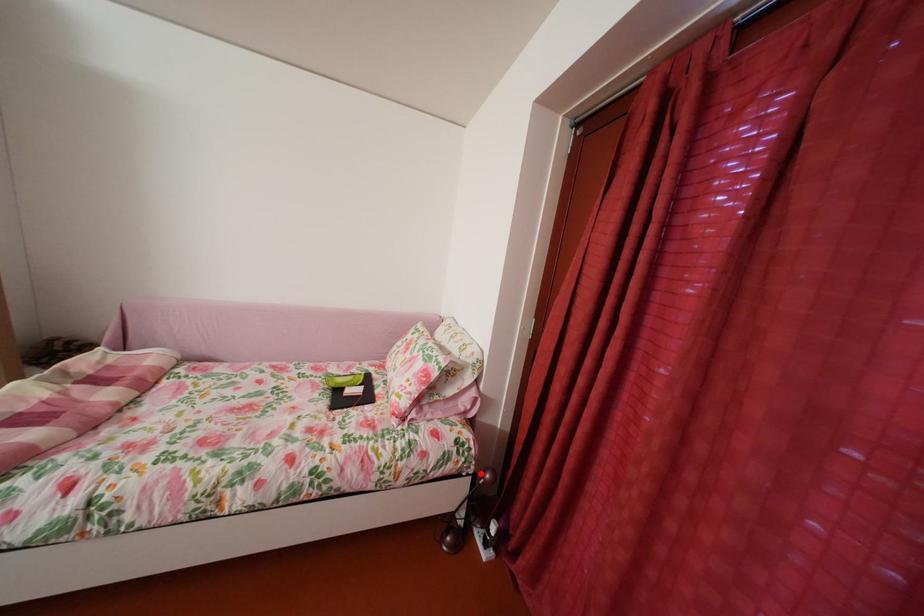
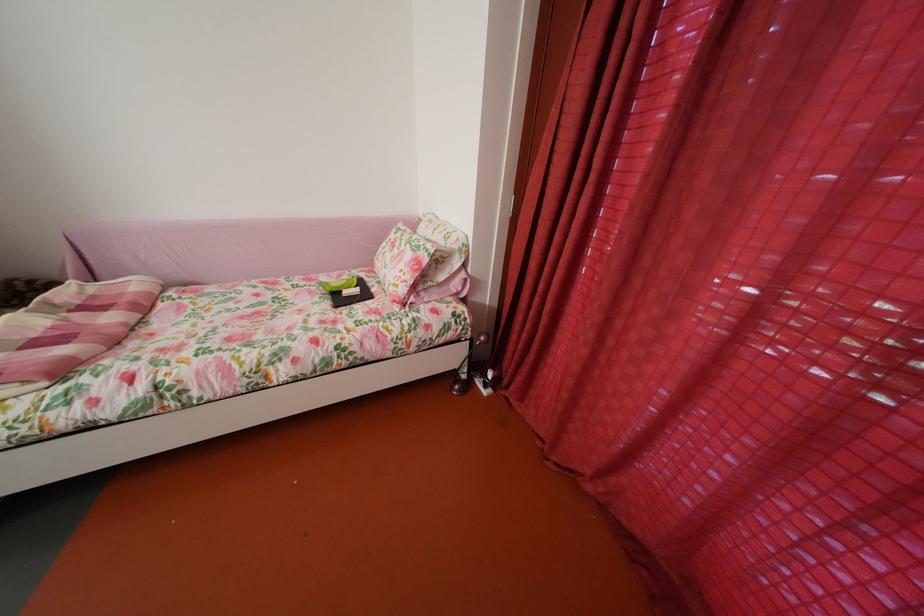
Where in the second image is the point corresponding to the highlighted location from the first image?

(478, 339)